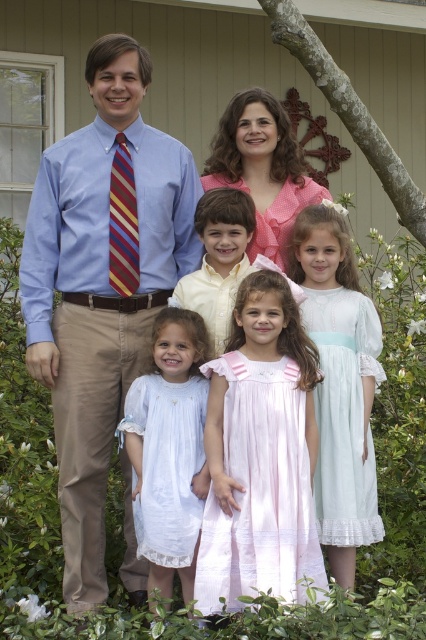
The height and width of the screenshot is (640, 426). I want to click on pink satin dress at center, so click(x=259, y=454).

Where is `pink satin dress at center`? This screenshot has height=640, width=426. pink satin dress at center is located at coordinates (259, 454).

Does light blue sheer dress at center appear on the right side of striped fabric tie at left?

Yes, light blue sheer dress at center is to the right of striped fabric tie at left.

Is light blue sheer dress at center smaller than striped fabric tie at left?

No.

Find the location of a particular element. Image resolution: width=426 pixels, height=640 pixels. light blue sheer dress at center is located at coordinates (339, 385).

Is pink satin dress at center positioned behind yellow cotton shirt at center?

No.

Is the position of pink satin dress at center less distant than that of yellow cotton shirt at center?

Yes.

At what (x,y) coordinates should I click in order to perform the action: click on pink satin dress at center. Please return your answer as a coordinate pair (x, y). The image size is (426, 640). Looking at the image, I should click on (259, 454).